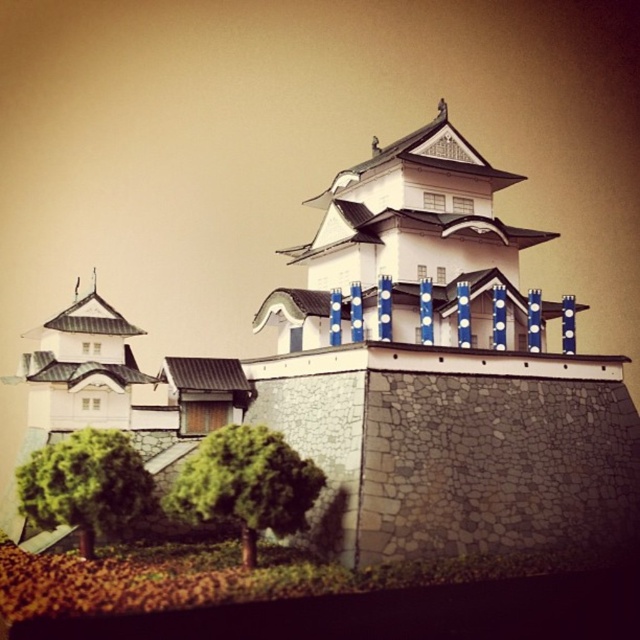
In the scene shown: Does white stone castle at center have a lesser height compared to green leafy tree at lower center?

In fact, white stone castle at center may be taller than green leafy tree at lower center.

Can you confirm if white stone castle at center is positioned below green leafy tree at lower center?

No.

Measure the distance between point (28, 356) and camera.

121.57 feet

Identify the location of white stone castle at center. (387, 374).

Which is behind, point (435, 280) or point (61, 481)?

The point (435, 280) is more distant.

Is white stone castle at center above green leafy tree at lower left?

Correct, white stone castle at center is located above green leafy tree at lower left.

The height and width of the screenshot is (640, 640). In order to click on white stone castle at center in this screenshot , I will do `click(387, 374)`.

Locate an element on the screen. The image size is (640, 640). white stone castle at center is located at coordinates (387, 374).

Who is higher up, green leafy tree at lower center or green leafy tree at lower left?

green leafy tree at lower left is higher up.

Between green leafy tree at lower center and green leafy tree at lower left, which one has more height?

green leafy tree at lower left

Locate an element on the screen. green leafy tree at lower center is located at coordinates (244, 484).